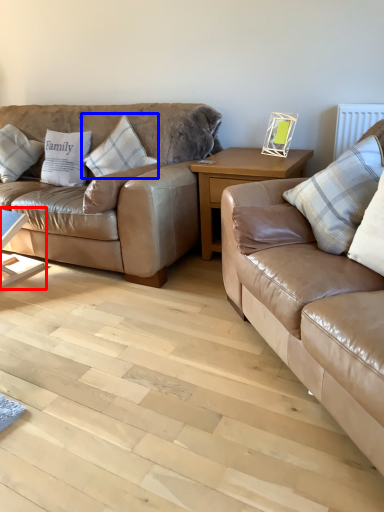
Question: Which object is further to the camera taking this photo, table (highlighted by a red box) or pillow (highlighted by a blue box)?

Choices:
 (A) table
 (B) pillow

Answer: (B)